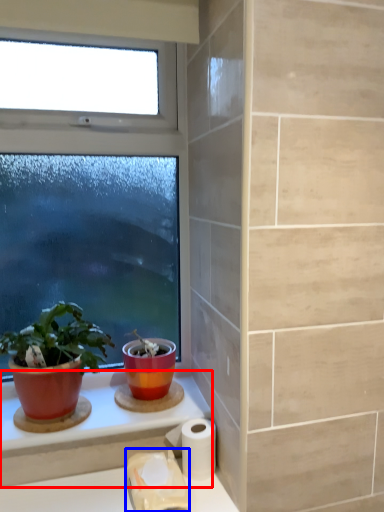
Question: Which of the following is the farthest to the observer, counter top (highlighted by a red box) or toilet paper (highlighted by a blue box)?

Choices:
 (A) counter top
 (B) toilet paper

Answer: (A)